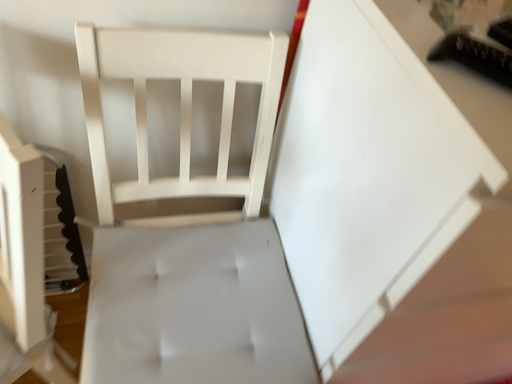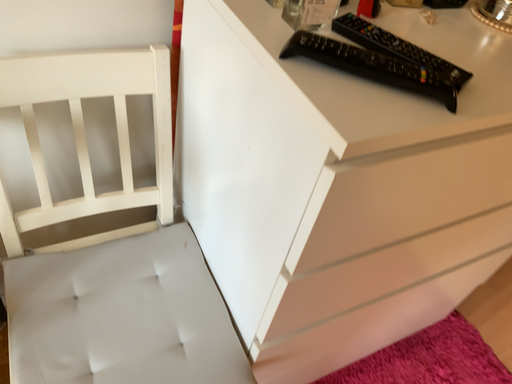
Question: Which way did the camera rotate in the video?

Choices:
 (A) rotated right
 (B) rotated left

Answer: (A)